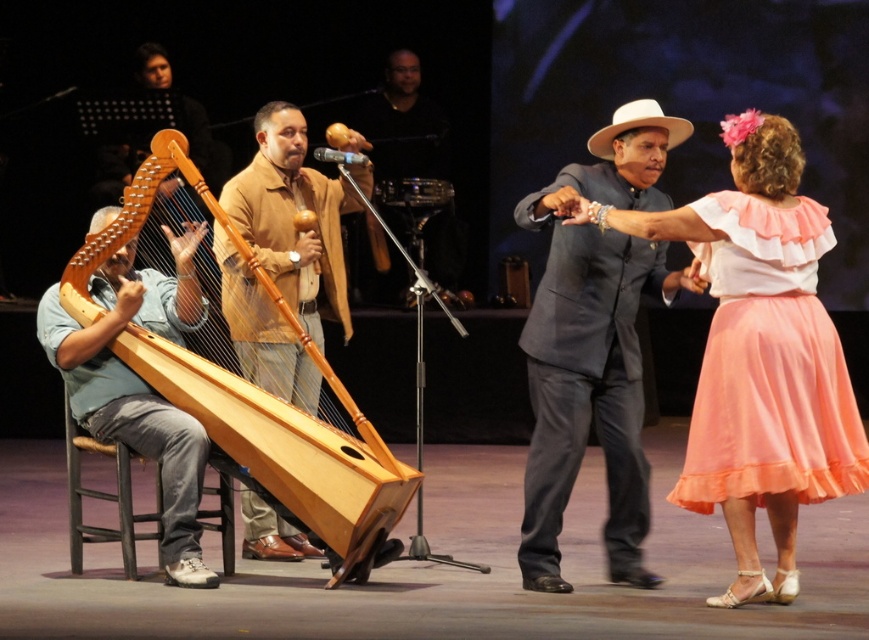
Can you confirm if pink satin skirt at center is taller than dark gray suit at center?

No, pink satin skirt at center is not taller than dark gray suit at center.

The height and width of the screenshot is (640, 869). I want to click on pink satin skirt at center, so click(760, 353).

I want to click on pink satin skirt at center, so click(x=760, y=353).

Is pink satin skirt at right smaller than wooden harp at center?

Result: Indeed, pink satin skirt at right has a smaller size compared to wooden harp at center.

Is point (733, 394) closer to camera compared to point (222, 193)?

Yes.

Between point (807, 404) and point (230, 307), which one is positioned in front?

Positioned in front is point (807, 404).

You are a GUI agent. You are given a task and a screenshot of the screen. Output one action in this format:
    pyautogui.click(x=<x>, y=<y>)
    Task: Click on the pink satin skirt at right
    Image resolution: width=869 pixels, height=640 pixels.
    Given the screenshot: What is the action you would take?
    pyautogui.click(x=768, y=364)

Is pink satin skirt at center taller than pink satin skirt at right?

Yes.

Is pink satin skirt at center smaller than pink satin skirt at right?

Actually, pink satin skirt at center might be larger than pink satin skirt at right.

Identify the location of pink satin skirt at center. (760, 353).